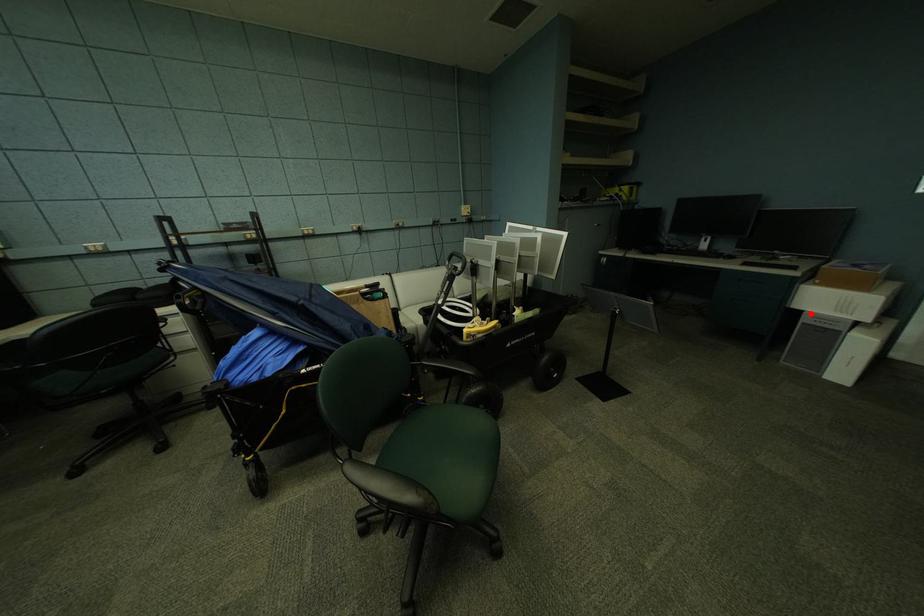
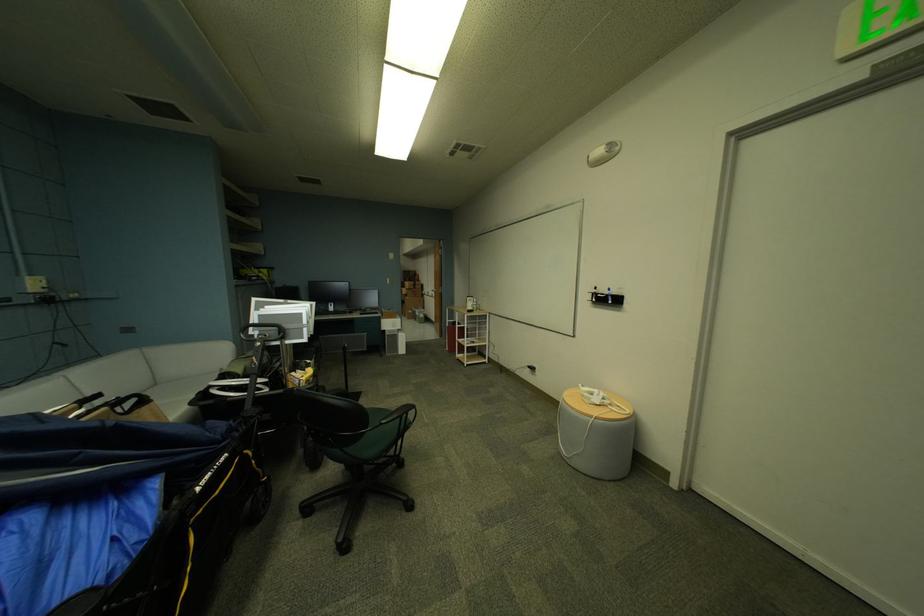
Question: I am providing you with two images of the same scene from different viewpoints. Given a red point in image1, look at the same physical point in image2. Is it:

Choices:
 (A) Closer to the viewpoint
 (B) Farther from the viewpoint

Answer: (A)